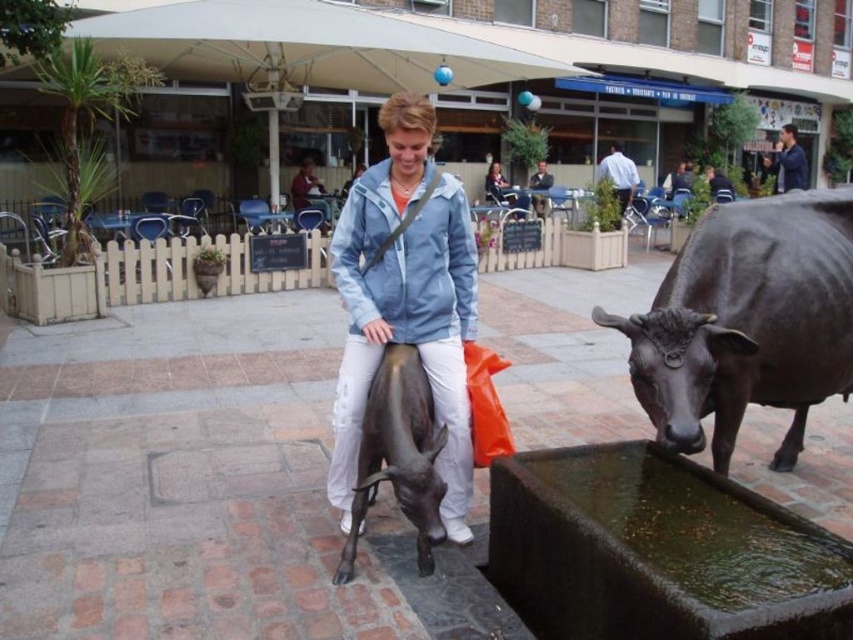
Question: Which object is the closest to the bronze statue at center?

Choices:
 (A) shiny dark brown bull at right
 (B) matte blue jacket at center

Answer: (B)

Question: Does shiny dark brown bull at right have a smaller size compared to bronze statue at center?

Choices:
 (A) yes
 (B) no

Answer: (B)

Question: Estimate the real-world distances between objects in this image. Which object is farther from the matte blue jacket at center?

Choices:
 (A) shiny dark brown bull at right
 (B) bronze statue at center

Answer: (A)

Question: Can you confirm if shiny dark brown bull at right is wider than matte blue jacket at center?

Choices:
 (A) no
 (B) yes

Answer: (B)

Question: Which object is farther from the camera taking this photo?

Choices:
 (A) shiny dark brown bull at right
 (B) bronze statue at center
 (C) matte blue jacket at center

Answer: (C)

Question: Is shiny dark brown bull at right thinner than bronze statue at center?

Choices:
 (A) yes
 (B) no

Answer: (B)